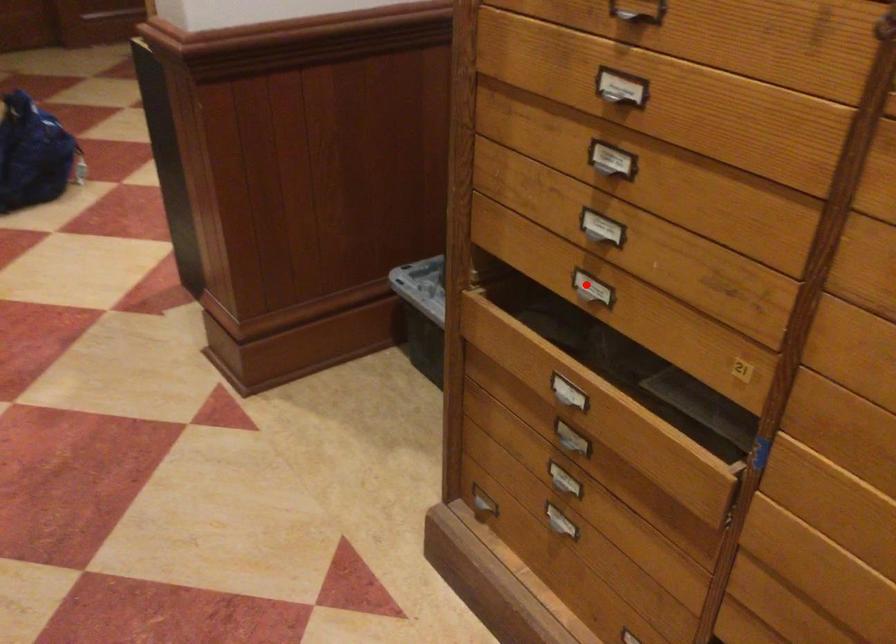
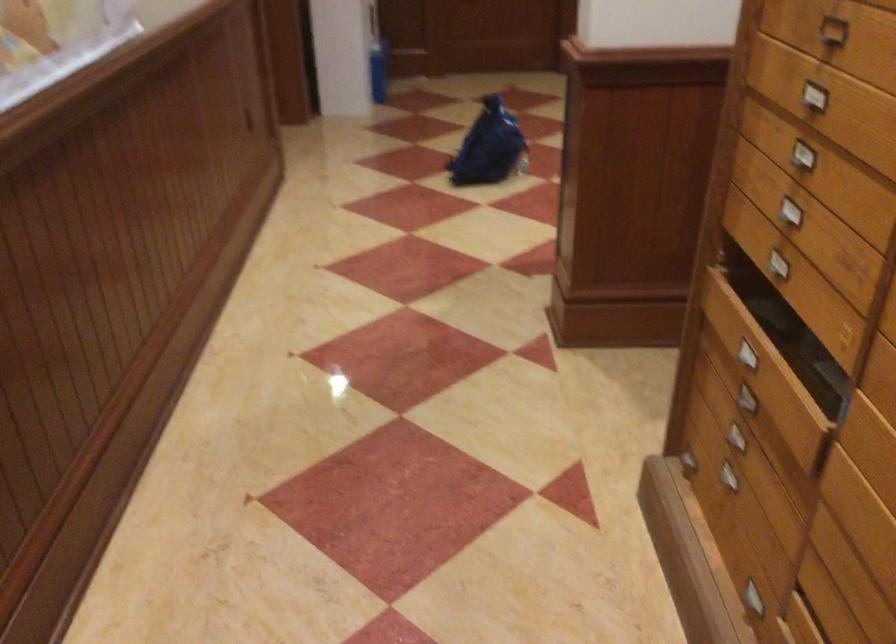
Question: A red point is marked in image1. In image2, is the corresponding 3D point closer to the camera or farther? Reply with the corresponding letter.

Choices:
 (A) The corresponding 3D point is closer.
 (B) The corresponding 3D point is farther.

Answer: (B)